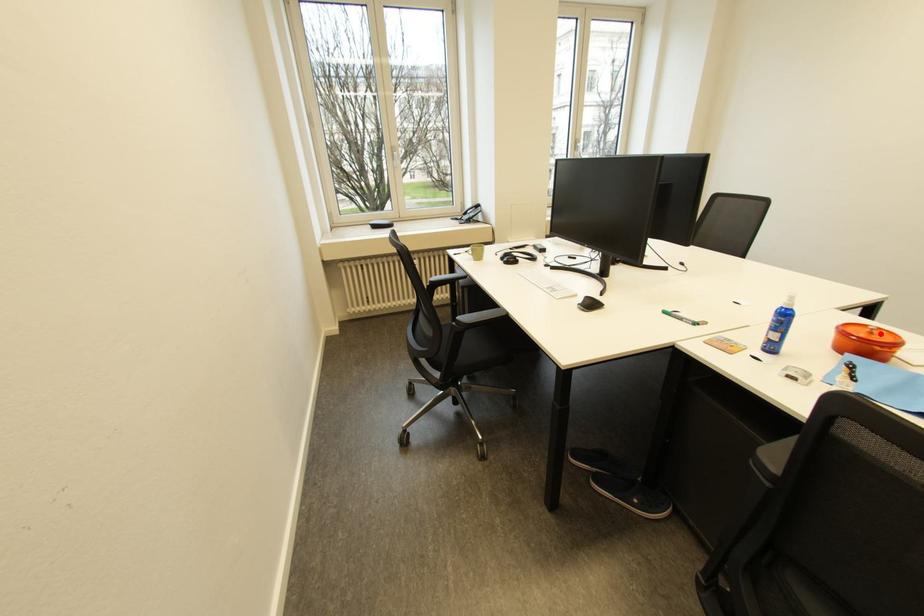
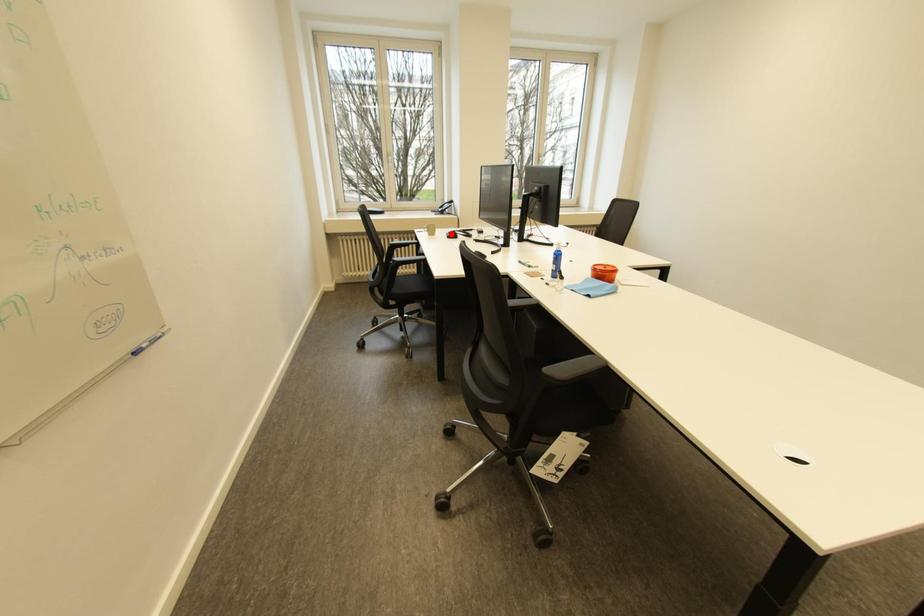
I am providing you with two images of the same scene from different viewpoints. A red point is marked on the first image and another point is marked on the second image. Is the red point in image1 aligned with the point shown in image2?

No